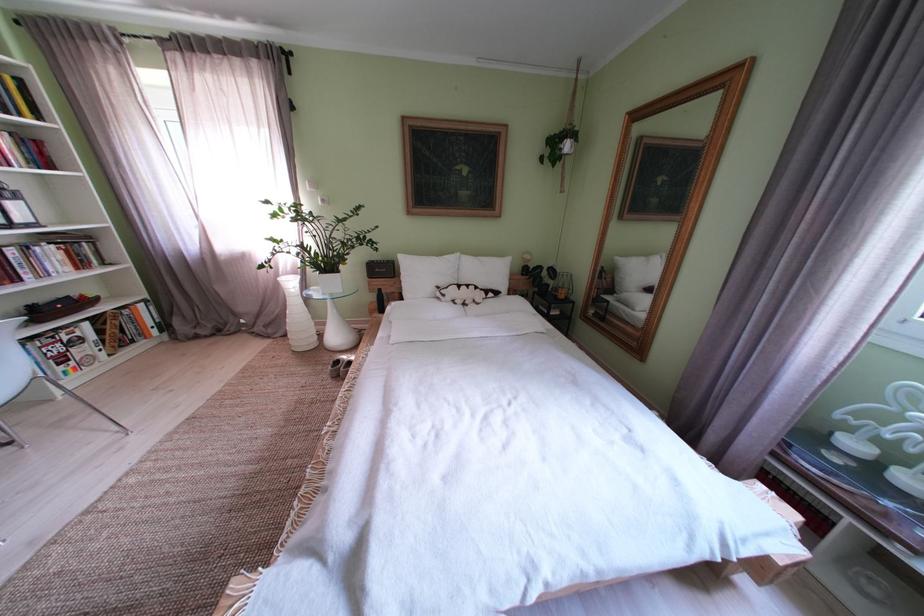
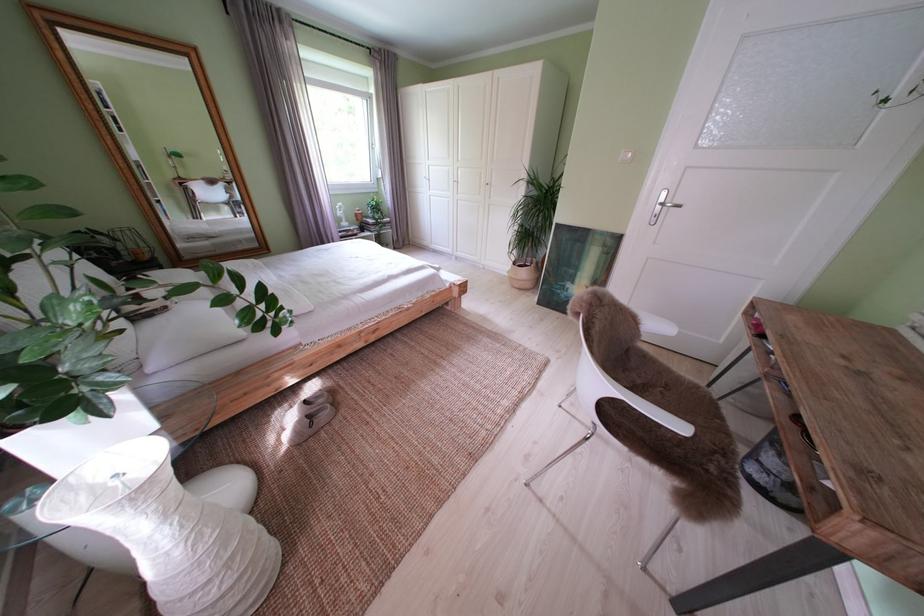
The point at (x=333, y=278) is marked in the first image. Where is the corresponding point in the second image?

(112, 395)